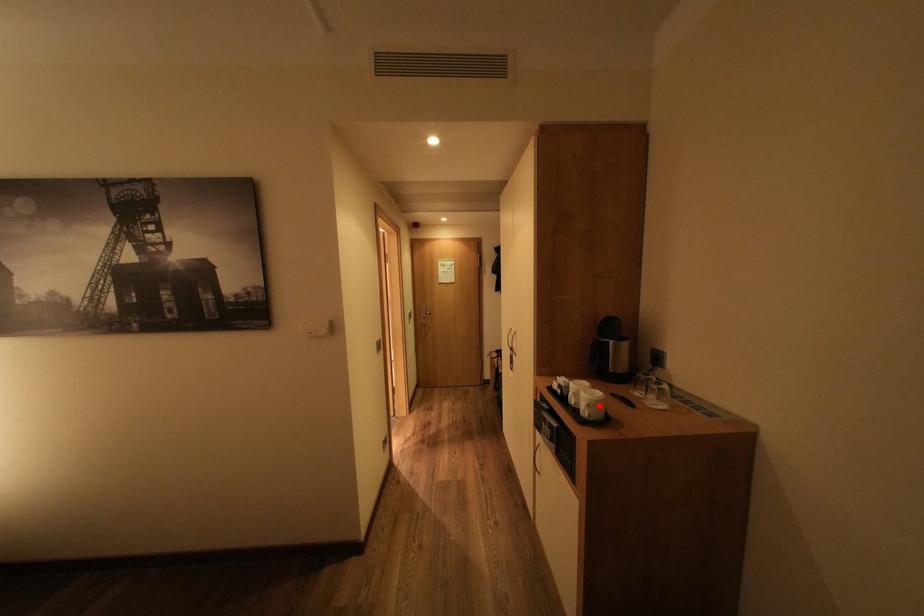
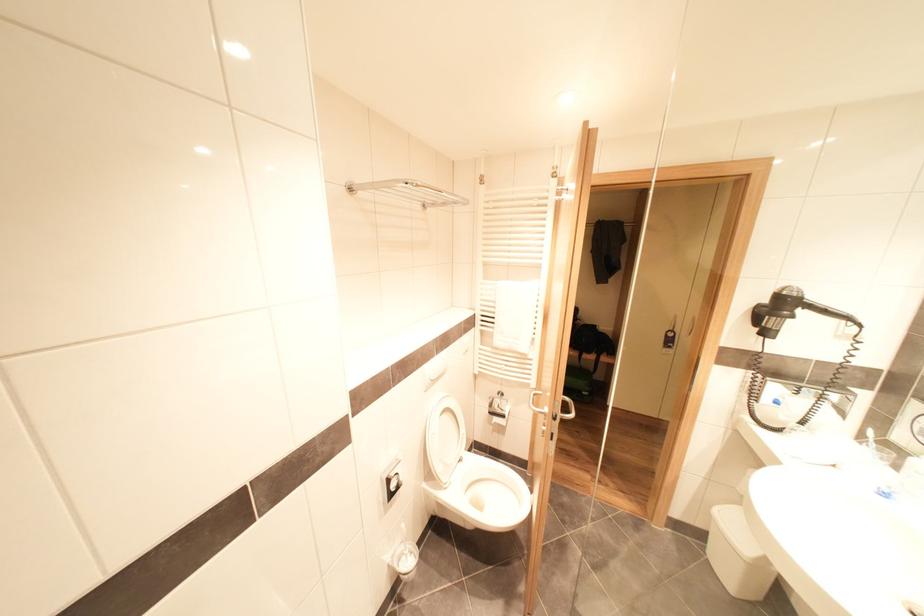
Question: I am providing you with two images of the same scene from different viewpoints. A red point is marked on the first image. Can you still see the location of the red point in image 2?

Choices:
 (A) Yes
 (B) No

Answer: (B)